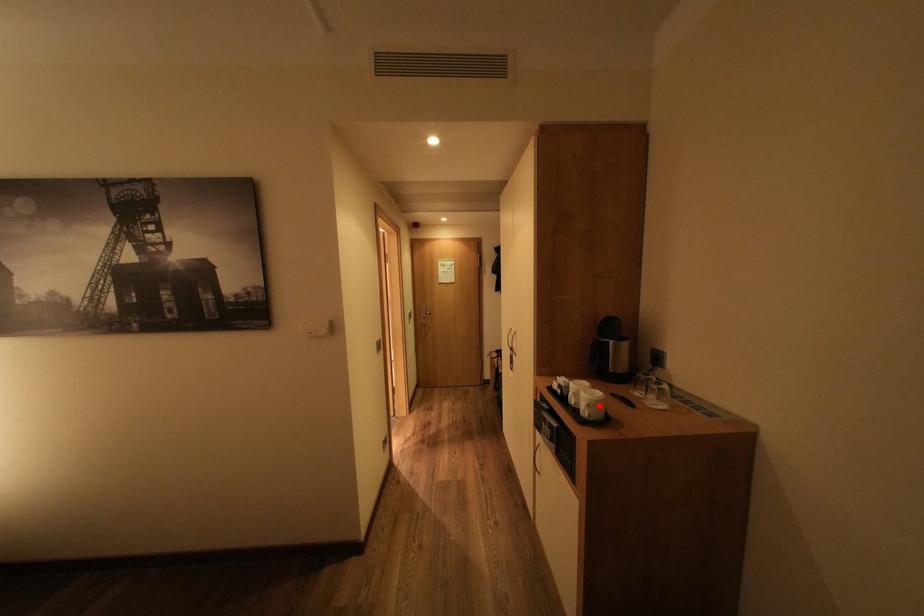
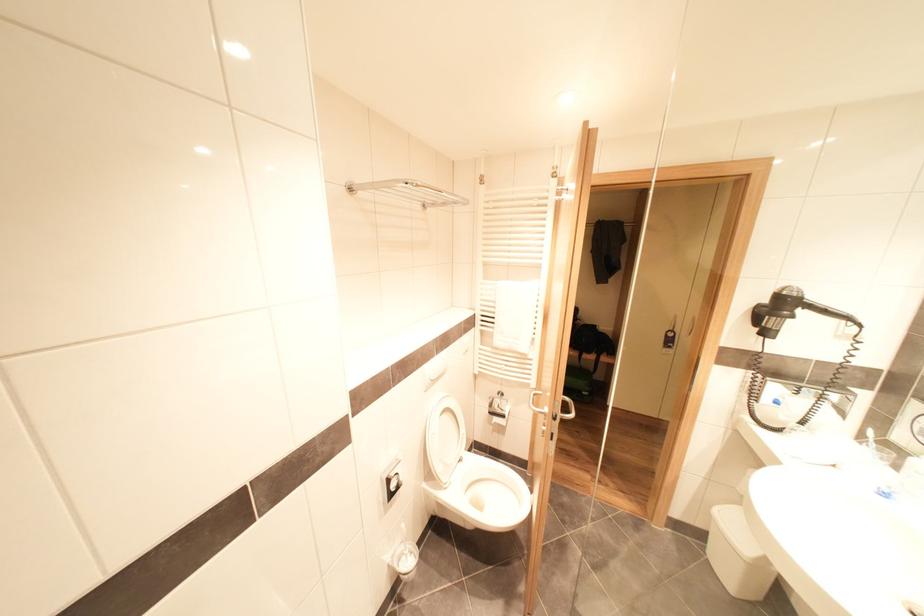
Question: I am providing you with two images of the same scene from different viewpoints. A red point is marked on the first image. Can you still see the location of the red point in image 2?

Choices:
 (A) Yes
 (B) No

Answer: (B)